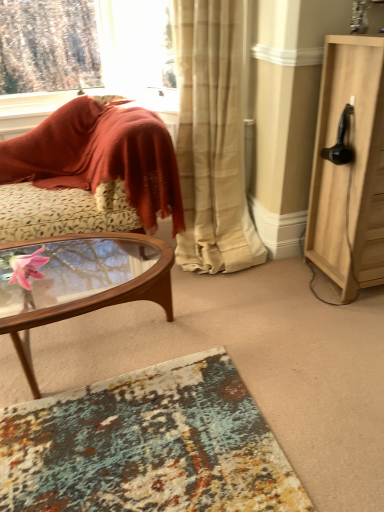
Question: Is woodenwoodencoffee table at left taller than textured rug at lower center?

Choices:
 (A) yes
 (B) no

Answer: (A)

Question: Is woodenwoodencoffee table at left turned away from textured rug at lower center?

Choices:
 (A) no
 (B) yes

Answer: (A)

Question: Is woodenwoodencoffee table at left positioned far away from textured rug at lower center?

Choices:
 (A) yes
 (B) no

Answer: (B)

Question: Is woodenwoodencoffee table at left at the left side of textured rug at lower center?

Choices:
 (A) no
 (B) yes

Answer: (B)

Question: From a real-world perspective, is woodenwoodencoffee table at left below textured rug at lower center?

Choices:
 (A) no
 (B) yes

Answer: (A)

Question: Considering the positions of point (241, 205) and point (39, 487), is point (241, 205) closer or farther from the camera than point (39, 487)?

Choices:
 (A) closer
 (B) farther

Answer: (B)

Question: From a real-world perspective, is beige sheer curtain at center above or below textured rug at lower center?

Choices:
 (A) below
 (B) above

Answer: (B)

Question: In the image, is beige sheer curtain at center positioned in front of or behind textured rug at lower center?

Choices:
 (A) front
 (B) behind

Answer: (B)

Question: Based on their positions, is beige sheer curtain at center located to the left or right of textured rug at lower center?

Choices:
 (A) left
 (B) right

Answer: (B)

Question: In terms of height, does beige sheer curtain at center look taller or shorter compared to light wood cabinet at right?

Choices:
 (A) short
 (B) tall

Answer: (B)

Question: Considering their positions, is beige sheer curtain at center located in front of or behind light wood cabinet at right?

Choices:
 (A) front
 (B) behind

Answer: (B)

Question: Does point (195, 6) appear closer or farther from the camera than point (311, 180)?

Choices:
 (A) farther
 (B) closer

Answer: (B)

Question: From the image's perspective, is beige sheer curtain at center positioned above or below light wood cabinet at right?

Choices:
 (A) above
 (B) below

Answer: (A)

Question: In terms of width, does velvet-like rust-colored cushion at left look wider or thinner when compared to textured rug at lower center?

Choices:
 (A) thin
 (B) wide

Answer: (A)

Question: Considering their positions, is velvet-like rust-colored cushion at left located in front of or behind textured rug at lower center?

Choices:
 (A) behind
 (B) front

Answer: (A)